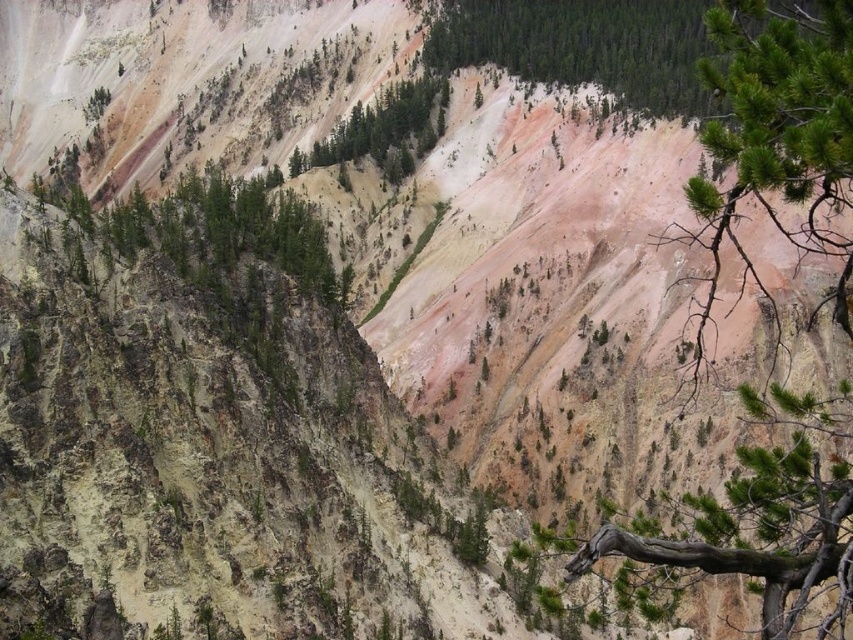
From the picture: You are a hiker planning to navigate between the green textured pine branch at upper right and the green textured tree at center. Given that your average walking pace is 1.5 meters per second, how long will it take you to walk directly between them?

The green textured pine branch at upper right and green textured tree at center are 54.67 meters apart from each other. At a pace of 1.5 meters per second, it would take approximately 36.45 seconds to walk between them.

You are a hiker standing at the base of the mountain, looking up at the green textured pine branch at upper right. You want to throw a pebble to hit the branch. If your throwing range is 50 meters, will you be able to reach it?

The green textured pine branch at upper right is 54.69 meters away from you. Since your throwing range is 50 meters, you cannot reach it.

You are a hiker trying to navigate through this mountainous area. You see a green textured pine branch at upper right and a green textured tree at center. Which one is taller?

The green textured pine branch at upper right is taller than the green textured tree at center.